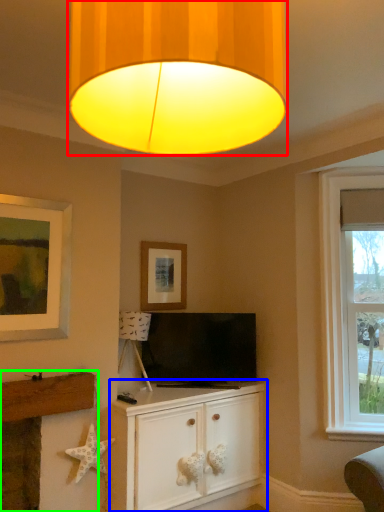
Question: Which object is positioned closest to lamp (highlighted by a red box)? Select from cabinetry (highlighted by a blue box) and fireplace (highlighted by a green box).

Choices:
 (A) cabinetry
 (B) fireplace

Answer: (A)